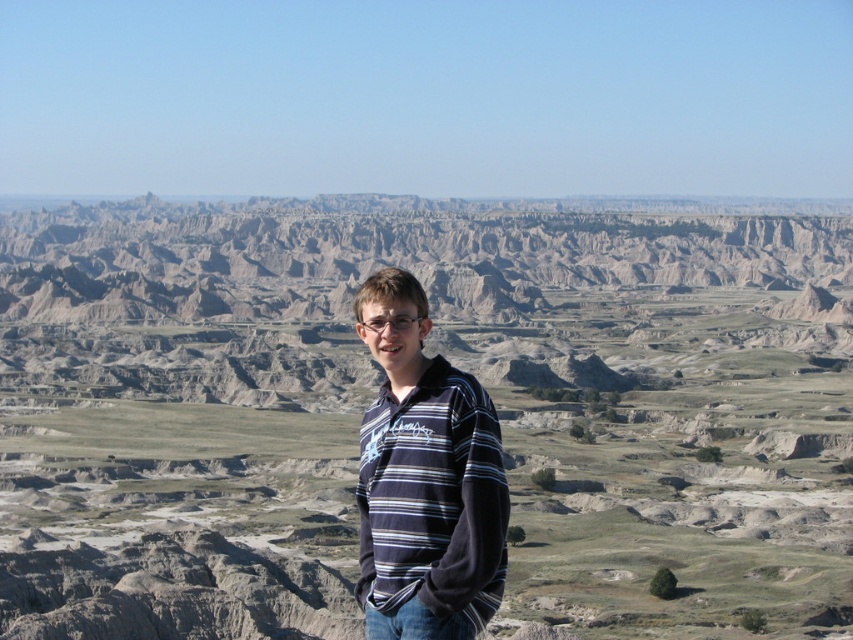
You are a hiker trying to navigate through the rugged terrain. You see the gray rock formation at center and the striped cotton shirt at center. Which object is higher in elevation?

The gray rock formation at center is above the striped cotton shirt at center, so it is higher in elevation.

Based on the photo, you are a hiker who wants to take a photo of the striped cotton shirt at center and the gray rock formation at center. Which object should you focus on first if you want both to be in sharp focus?

You should focus on the gray rock formation at center first because it is taller than the striped cotton shirt at center, so focusing on the farther object ensures both will be in focus.

You are navigating through the rugged landscape and want to reach the point at coordinates point (560, 504). You are currently at point (375, 412). Considering the terrain, which direction should you move to get closer to your destination?

Point (560, 504) is behind point (375, 412), so you should move backward to reach it.